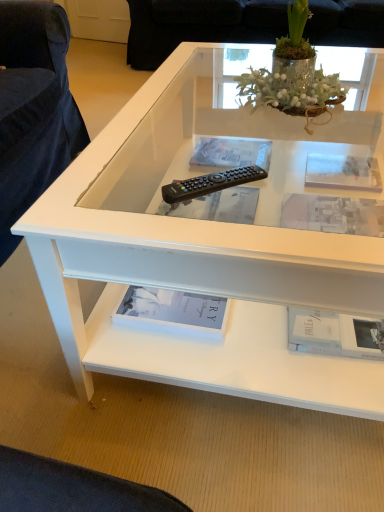
Find the location of a particular element. The height and width of the screenshot is (512, 384). empty space that is ontop of transparent glass frame at upper center is located at coordinates (334, 168).